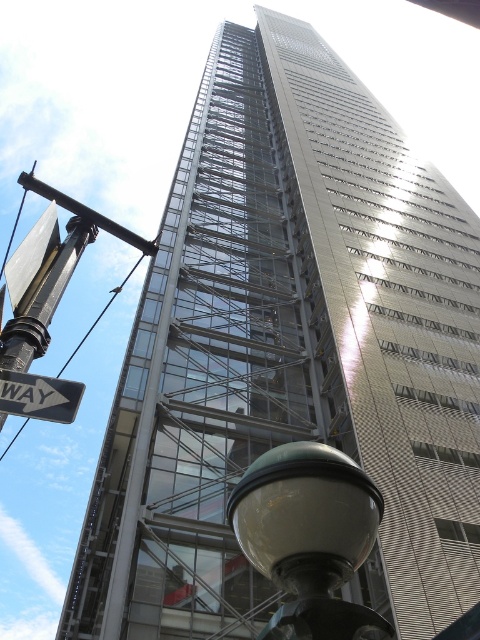
Question: Which object appears farthest from the camera in this image?

Choices:
 (A) black plastic street sign at left
 (B) matte glass street light at lower center

Answer: (A)

Question: Which of the following is the farthest from the observer?

Choices:
 (A) (283, 611)
 (B) (9, 410)

Answer: (B)

Question: Is matte glass street light at lower center positioned behind black plastic street sign at left?

Choices:
 (A) yes
 (B) no

Answer: (B)

Question: Is matte glass street light at lower center closer to the viewer compared to black plastic street sign at left?

Choices:
 (A) no
 (B) yes

Answer: (B)

Question: Is matte glass street light at lower center thinner than black plastic street sign at left?

Choices:
 (A) yes
 (B) no

Answer: (B)

Question: Which point is farther to the camera?

Choices:
 (A) 259,544
 (B) 60,417

Answer: (B)